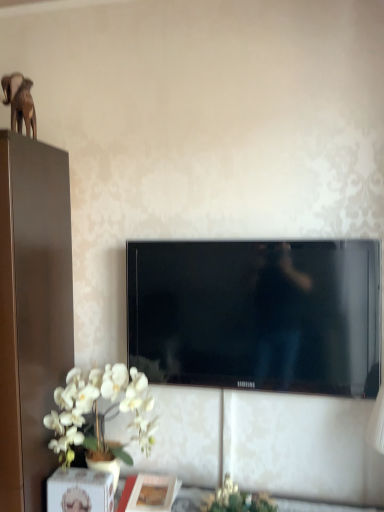
Question: Does matte white picture frame at lower center lie in front of green leafy plant at lower center?

Choices:
 (A) no
 (B) yes

Answer: (A)

Question: Is matte white picture frame at lower center oriented away from green leafy plant at lower center?

Choices:
 (A) yes
 (B) no

Answer: (B)

Question: Is there a large distance between matte white picture frame at lower center and green leafy plant at lower center?

Choices:
 (A) no
 (B) yes

Answer: (A)

Question: Considering the relative sizes of matte white picture frame at lower center and green leafy plant at lower center in the image provided, is matte white picture frame at lower center taller than green leafy plant at lower center?

Choices:
 (A) no
 (B) yes

Answer: (A)

Question: Is matte white picture frame at lower center surrounding green leafy plant at lower center?

Choices:
 (A) no
 (B) yes

Answer: (A)

Question: Is matte white picture frame at lower center completely or partially outside of green leafy plant at lower center?

Choices:
 (A) no
 (B) yes

Answer: (B)

Question: Is white matte orchid at lower left not near green leafy plant at lower center?

Choices:
 (A) yes
 (B) no

Answer: (B)

Question: Is white matte orchid at lower left surrounding green leafy plant at lower center?

Choices:
 (A) no
 (B) yes

Answer: (A)

Question: Is white matte orchid at lower left positioned behind green leafy plant at lower center?

Choices:
 (A) yes
 (B) no

Answer: (A)

Question: From the image's perspective, is white matte orchid at lower left below green leafy plant at lower center?

Choices:
 (A) yes
 (B) no

Answer: (B)

Question: From a real-world perspective, is white matte orchid at lower left beneath green leafy plant at lower center?

Choices:
 (A) yes
 (B) no

Answer: (B)

Question: Does white matte orchid at lower left have a larger size compared to green leafy plant at lower center?

Choices:
 (A) no
 (B) yes

Answer: (B)

Question: Can you confirm if black glossy tv at center is bigger than white matte orchid at lower left?

Choices:
 (A) yes
 (B) no

Answer: (A)